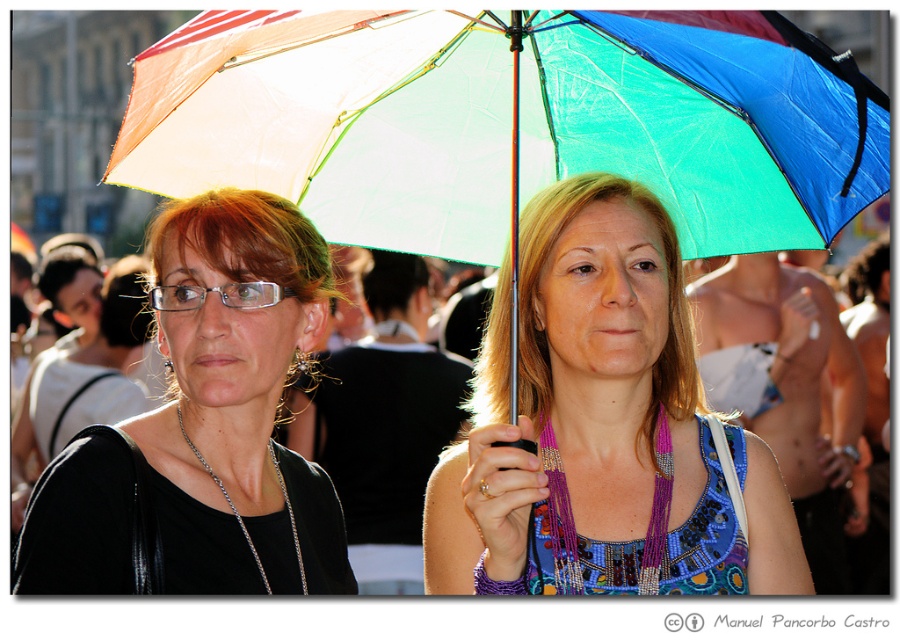
Question: Can you confirm if rainbow fabric umbrella at center is positioned to the left of multicolored fabric umbrella at center?

Choices:
 (A) yes
 (B) no

Answer: (A)

Question: Which of the following is the closest to the observer?

Choices:
 (A) matte black shirt at upper left
 (B) rainbow fabric umbrella at center
 (C) multicolored fabric umbrella at center

Answer: (B)

Question: Among these points, which one is nearest to the camera?

Choices:
 (A) (169, 522)
 (B) (541, 164)
 (C) (644, 346)

Answer: (A)

Question: Does multicolored fabric umbrella at center appear on the right side of matte black shirt at upper left?

Choices:
 (A) yes
 (B) no

Answer: (A)

Question: Considering the relative positions of rainbow fabric umbrella at center and matte black shirt at upper left in the image provided, where is rainbow fabric umbrella at center located with respect to matte black shirt at upper left?

Choices:
 (A) right
 (B) left

Answer: (A)

Question: Estimate the real-world distances between objects in this image. Which object is closer to the matte black shirt at upper left?

Choices:
 (A) rainbow fabric umbrella at center
 (B) multicolored fabric umbrella at center

Answer: (A)